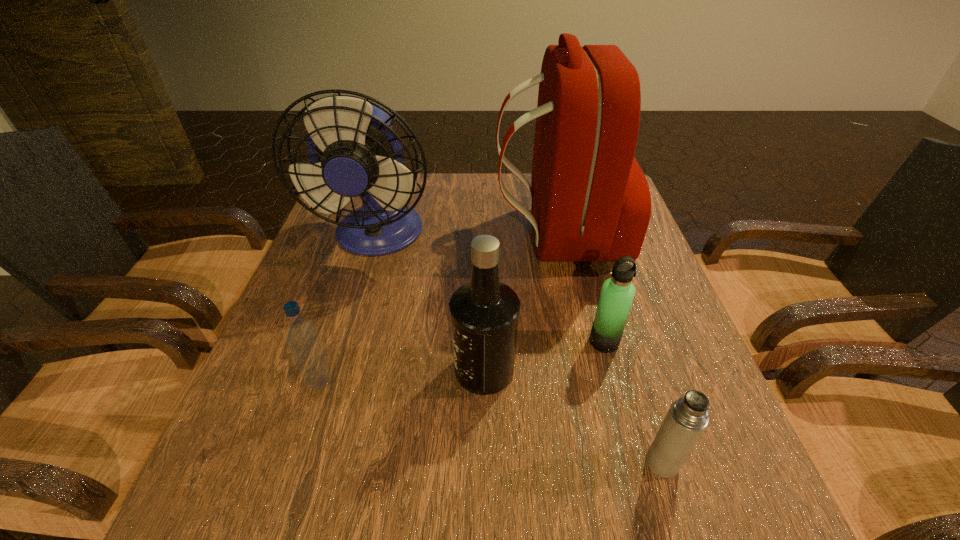
This screenshot has height=540, width=960. Find the location of `backpack`. backpack is located at coordinates (590, 201).

Locate an element on the screen. Image resolution: width=960 pixels, height=540 pixels. the fifth shortest object is located at coordinates (354, 151).

What are the coordinates of `liquor` in the screenshot? It's located at (484, 312).

The width and height of the screenshot is (960, 540). Find the location of `the farther thermos bottle`. the farther thermos bottle is located at coordinates (617, 294).

Where is `water bottle`? water bottle is located at coordinates (302, 336).

This screenshot has height=540, width=960. Identify the location of the nearer thermos bottle. (687, 418).

The width and height of the screenshot is (960, 540). I want to click on the shorter thermos bottle, so click(687, 418).

Identify the location of vacant space located on the strap side of the backpack. The height and width of the screenshot is (540, 960). (356, 237).

Image resolution: width=960 pixels, height=540 pixels. In order to click on free space located on the strap side of the backpack in this screenshot , I will do `click(364, 237)`.

Locate an element on the screen. The width and height of the screenshot is (960, 540). free location located 0.340m on the strap side of the backpack is located at coordinates (368, 237).